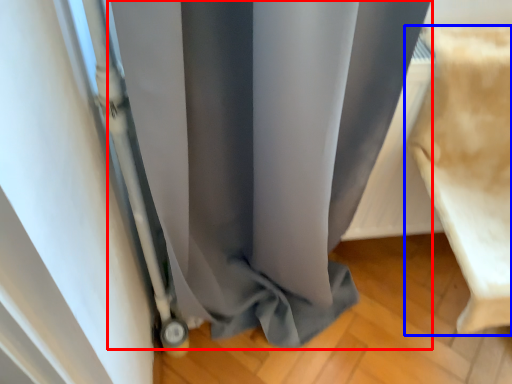
Question: Among these objects, which one is farthest to the camera, curtain (highlighted by a red box) or furniture (highlighted by a blue box)?

Choices:
 (A) curtain
 (B) furniture

Answer: (B)